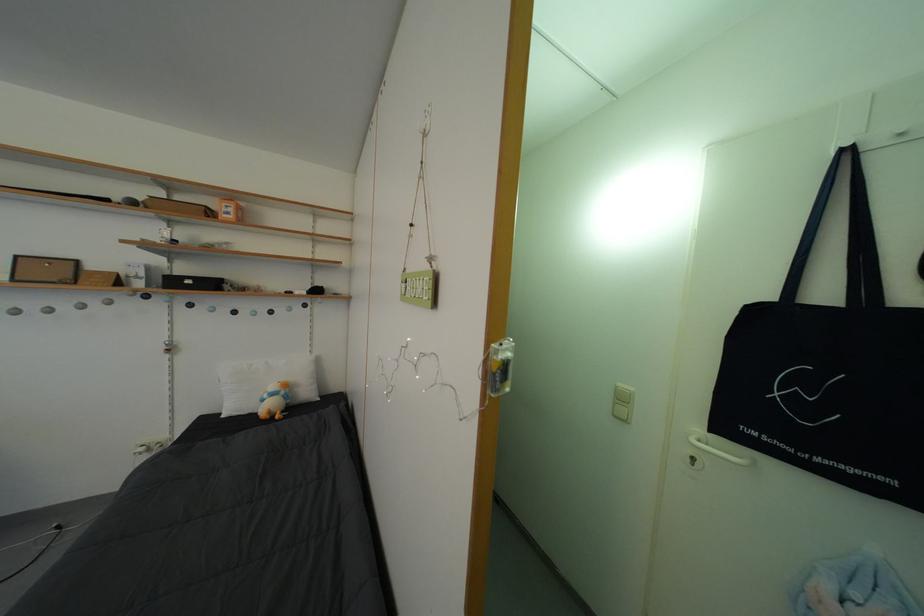
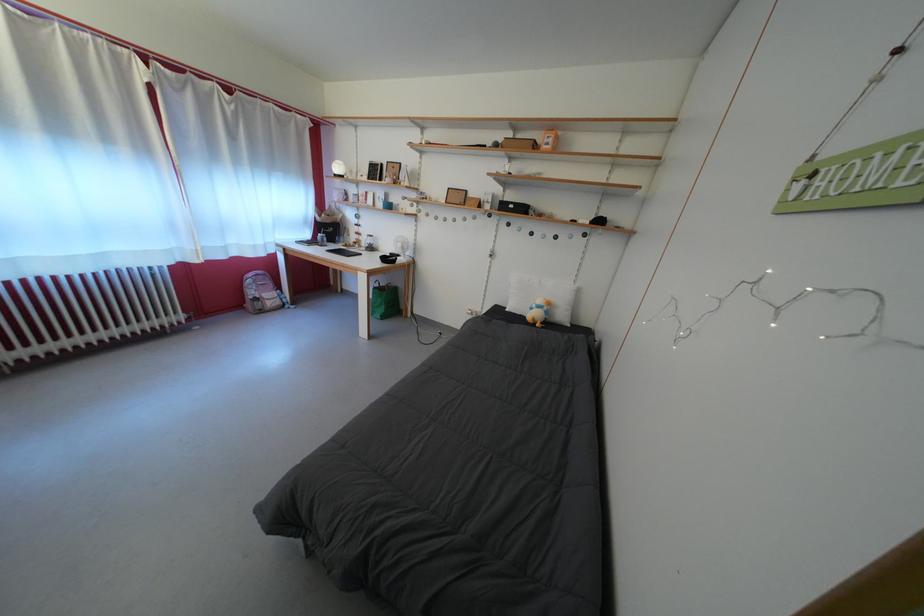
Locate, in the second image, the point that corresponds to (274,400) in the first image.

(542, 312)